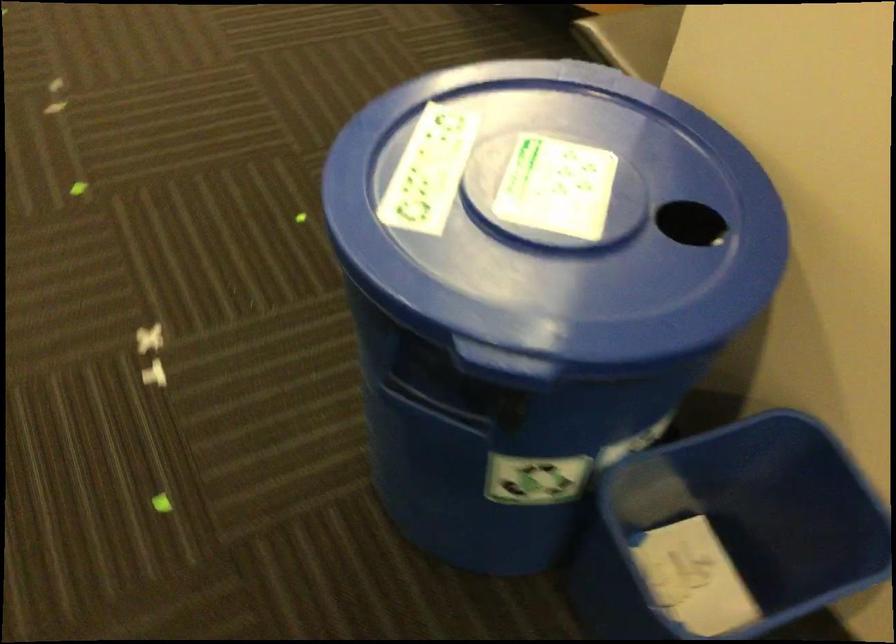
Image resolution: width=896 pixels, height=644 pixels. Find the location of `trash can opening`. trash can opening is located at coordinates (691, 223).